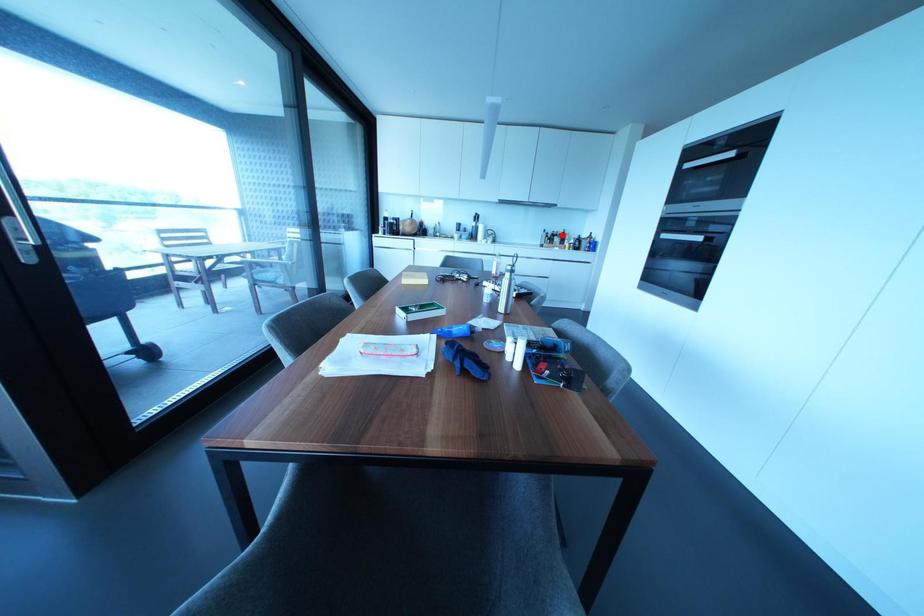
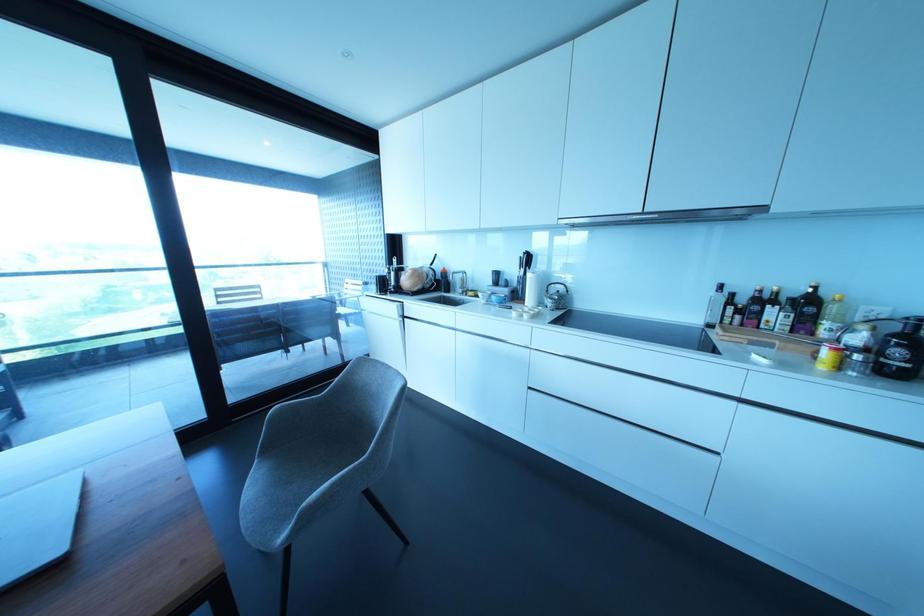
The point at the highlighted location is marked in the first image. Where is the corresponding point in the second image?

(807, 304)